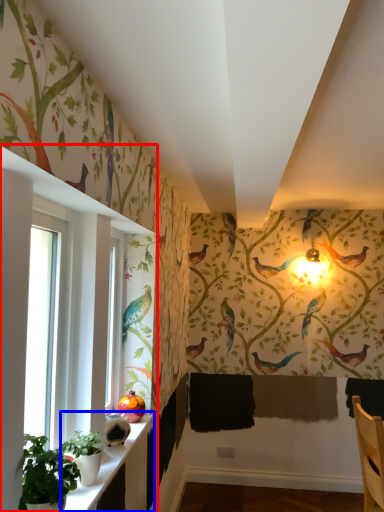
Question: Which of the following is the farthest to the observer, window (highlighted by a red box) or window sill (highlighted by a blue box)?

Choices:
 (A) window
 (B) window sill

Answer: (B)